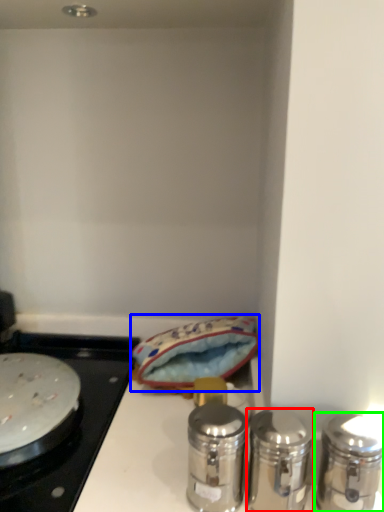
Question: Which object is the closest to the salt and pepper shakers (highlighted by a red box)? Choose among these: material (highlighted by a blue box) or salt and pepper shakers (highlighted by a green box).

Choices:
 (A) material
 (B) salt and pepper shakers

Answer: (B)